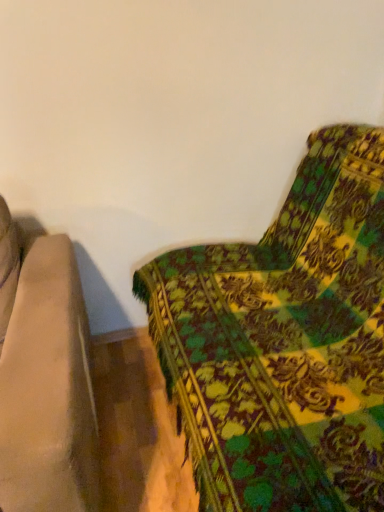
Where is `green patterned fabric at right`? green patterned fabric at right is located at coordinates (284, 342).

What do you see at coordinates (284, 342) in the screenshot?
I see `green patterned fabric at right` at bounding box center [284, 342].

Where is `green patterned fabric at right`? Image resolution: width=384 pixels, height=512 pixels. green patterned fabric at right is located at coordinates (284, 342).